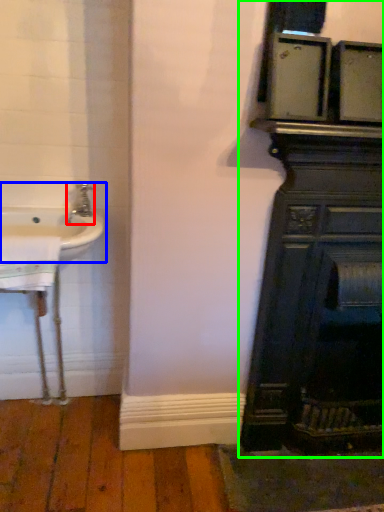
Question: Which is farther away from tap (highlighted by a red box)? sink (highlighted by a blue box) or bathroom cabinet (highlighted by a green box)?

Choices:
 (A) sink
 (B) bathroom cabinet

Answer: (B)